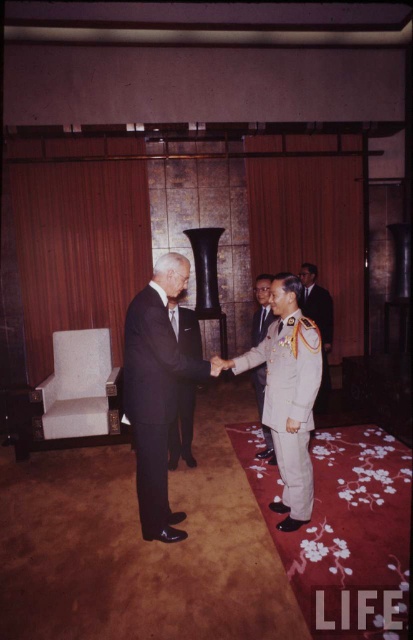
Question: Which object is positioned farthest from the black suit at center?

Choices:
 (A) matte black suit at center
 (B) khaki fabric uniform at center
 (C) light gray uniform at center

Answer: (C)

Question: Can you confirm if black suit at center is smaller than matte black suit at center?

Choices:
 (A) yes
 (B) no

Answer: (B)

Question: Where is black suit at center located in relation to matte black suit at center in the image?

Choices:
 (A) above
 (B) below

Answer: (A)

Question: Which object is the farthest from the black suit at center?

Choices:
 (A) matte black suit at center
 (B) light gray uniform at center
 (C) khaki fabric uniform at center
 (D) silver metallic uniform at center

Answer: (D)

Question: Among these points, which one is farthest from the camera?

Choices:
 (A) pos(289,408)
 (B) pos(324,337)
 (C) pos(192,356)

Answer: (B)

Question: Does khaki fabric uniform at center have a smaller size compared to light gray uniform at center?

Choices:
 (A) no
 (B) yes

Answer: (A)